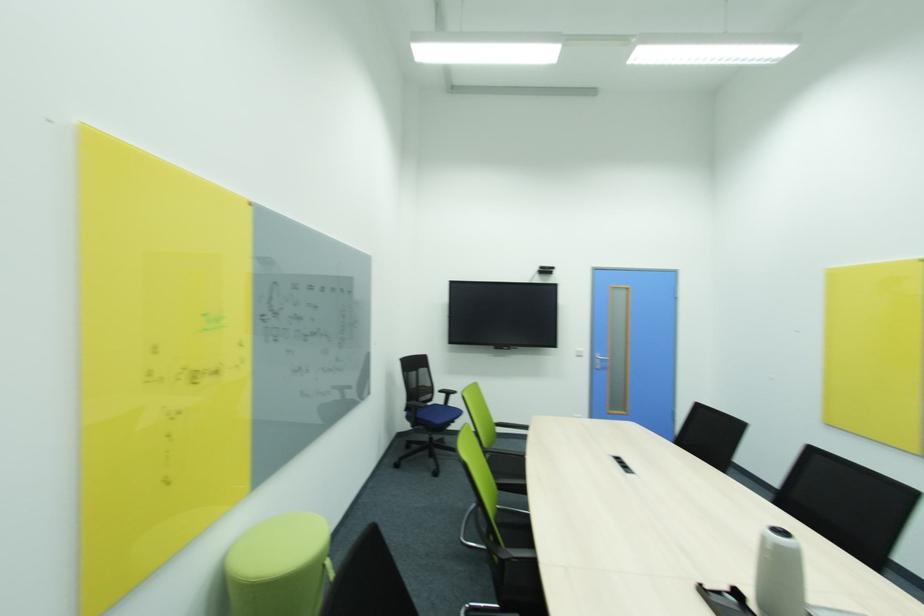
Find the location of a particular element. silver door handle is located at coordinates (599, 361).